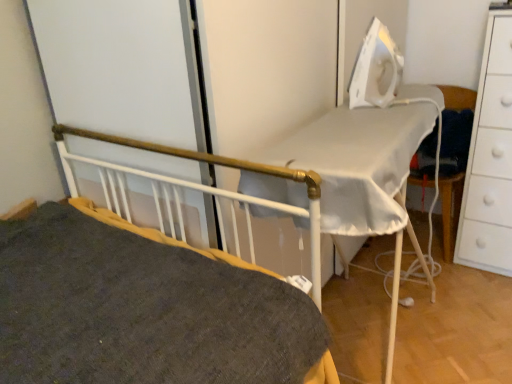
Question: Based on their positions, is white fabric chair at right located to the left or right of dark gray fabric bed at center?

Choices:
 (A) right
 (B) left

Answer: (A)

Question: Is white fabric chair at right spatially inside dark gray fabric bed at center, or outside of it?

Choices:
 (A) inside
 (B) outside

Answer: (B)

Question: Estimate the real-world distances between objects in this image. Which object is closer to the white matte chest of drawers at right?

Choices:
 (A) white plastic iron at upper right
 (B) dark gray fabric bed at center
 (C) white fabric chair at right

Answer: (C)

Question: Which object is positioned closest to the white plastic iron at upper right?

Choices:
 (A) white fabric chair at right
 (B) white matte chest of drawers at right
 (C) dark gray fabric bed at center

Answer: (C)